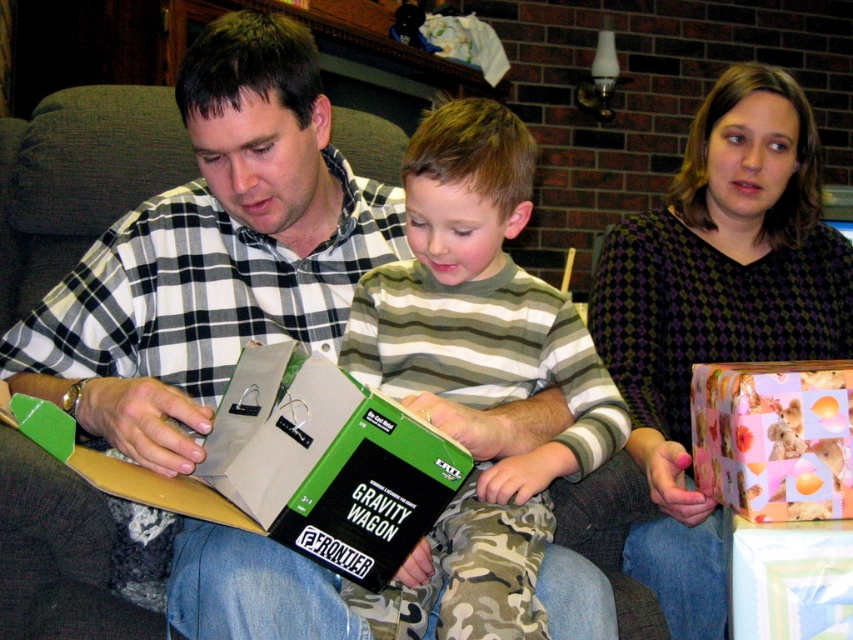
Measure the distance between point (782,268) and camera.

Point (782,268) is 1.53 meters away from camera.

From the picture: Which is more to the left, dark purple checkered sweater at upper right or green matte box at center?

green matte box at center

The image size is (853, 640). What do you see at coordinates (717, 308) in the screenshot?
I see `dark purple checkered sweater at upper right` at bounding box center [717, 308].

Locate an element on the screen. Image resolution: width=853 pixels, height=640 pixels. dark purple checkered sweater at upper right is located at coordinates (717, 308).

Can you confirm if green striped shirt at center is wider than dark purple checkered sweater at upper right?

Incorrect, green striped shirt at center's width does not surpass dark purple checkered sweater at upper right's.

Image resolution: width=853 pixels, height=640 pixels. What are the coordinates of `green striped shirt at center` in the screenshot? It's located at point(476,374).

Find the location of a particular element. The width and height of the screenshot is (853, 640). green striped shirt at center is located at coordinates pos(476,374).

Consider the image. Who is lower down, dark purple checkered sweater at upper right or pink paper gift at right?

pink paper gift at right is lower down.

Is point (721, 216) more distant than point (734, 403)?

Yes.

The height and width of the screenshot is (640, 853). Find the location of `dark purple checkered sweater at upper right`. dark purple checkered sweater at upper right is located at coordinates (717, 308).